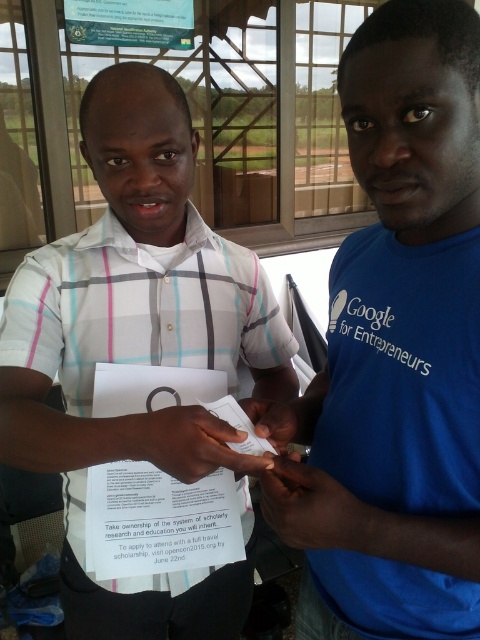
Question: Which point is farther to the camera?

Choices:
 (A) white paper at center
 (B) blue cotton shirt at right
 (C) white checkered shirt at center

Answer: (A)

Question: Among these objects, which one is farthest from the camera?

Choices:
 (A) blue cotton t-shirt at center
 (B) white checkered shirt at center
 (C) blue cotton shirt at right
 (D) white paper at center

Answer: (D)

Question: Is the position of blue cotton t-shirt at center more distant than that of white paper at center?

Choices:
 (A) yes
 (B) no

Answer: (B)

Question: Which point appears farthest from the camera in this image?

Choices:
 (A) (464, 205)
 (B) (391, 360)
 (C) (193, 224)

Answer: (C)

Question: Observing the image, what is the correct spatial positioning of white checkered shirt at center in reference to white paper at center?

Choices:
 (A) below
 (B) above

Answer: (B)

Question: From the image, what is the correct spatial relationship of blue cotton shirt at right in relation to white paper at center?

Choices:
 (A) above
 (B) below

Answer: (A)